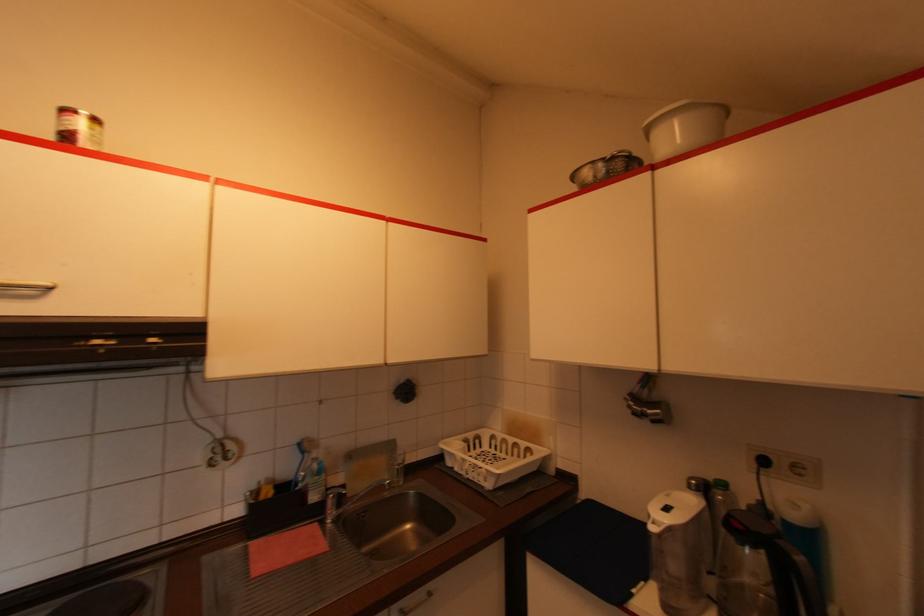
Which object does [685,128] point to?

This point indicates the white plastic bucket.